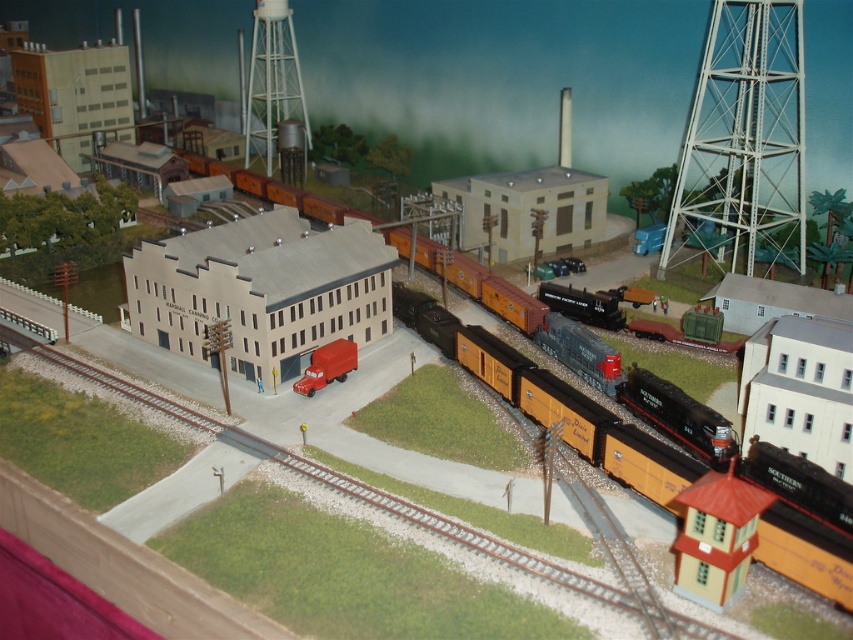
You are a model train enthusiast observing the layout. You notice the metallic freight car at center and the matte red truck at center. Which object is closer to your viewpoint?

The metallic freight car at center is closer to your viewpoint because it is further to the viewer than the matte red truck at center.

You are a model train enthusiast examining the layout. You notice a metallic freight car at center and a matte red truck at center. Which one is positioned to the left of the other?

Result: The metallic freight car at center is to the left of the matte red truck at center.

You are a model train enthusiast who wants to place a new train car between the white metallic water tower at upper right and the white matte water tower at upper center. Based on their sizes, which tower should you position the car closer to for better visibility?

The white metallic water tower at upper right is bigger than the white matte water tower at upper center, so positioning the new train car closer to the white metallic water tower at upper right would ensure better visibility due to its larger size.